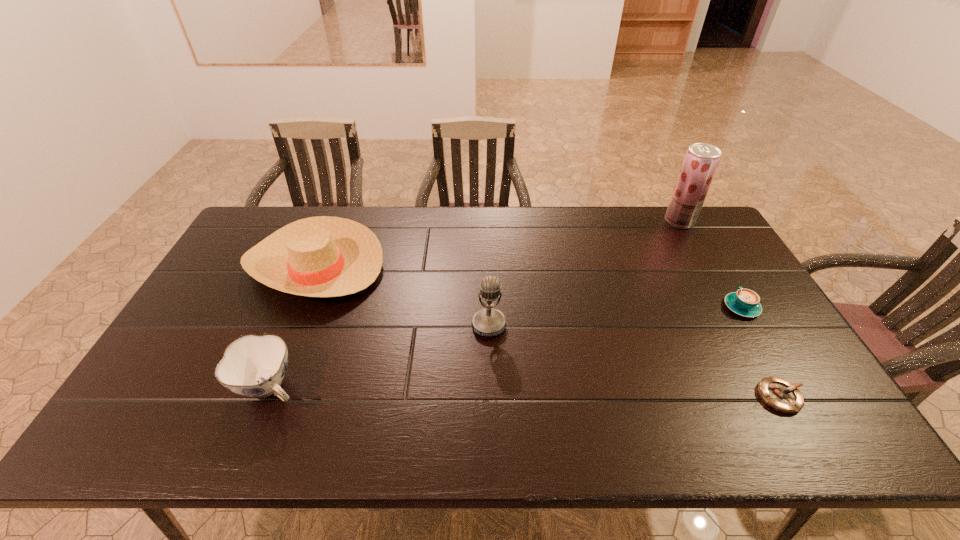
Find the location of a particular element. The height and width of the screenshot is (540, 960). the tallest object is located at coordinates (701, 161).

Find the location of `the fourth object from right to left`. the fourth object from right to left is located at coordinates (489, 322).

Locate an element on the screen. microphone is located at coordinates (489, 322).

You are a GUI agent. You are given a task and a screenshot of the screen. Output one action in this format:
    pyautogui.click(x=<x>, y=<y>)
    Task: Click on the sunhat
    
    Given the screenshot: What is the action you would take?
    pyautogui.click(x=324, y=256)

Find the location of a particular element. Image resolution: width=960 pixels, height=540 pixels. chinaware is located at coordinates pyautogui.click(x=252, y=366).

Where is `cappuccino`? cappuccino is located at coordinates (744, 302).

Locate an element on the screen. the shortest object is located at coordinates (779, 394).

Locate an element on the screen. The height and width of the screenshot is (540, 960). vacant space situated 0.190m on the front of the fruit juice is located at coordinates (705, 266).

Locate an element on the screen. This screenshot has width=960, height=540. free space located on the front-facing side of the second tallest object is located at coordinates (491, 421).

Find the location of a particular element. This screenshot has width=960, height=540. vacant space located 0.070m on the back of the sunhat is located at coordinates (335, 217).